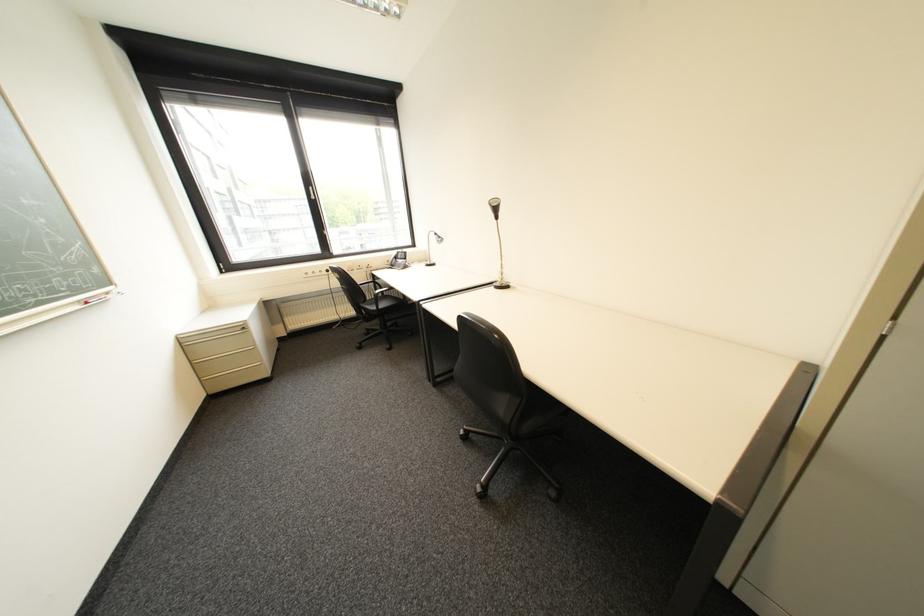
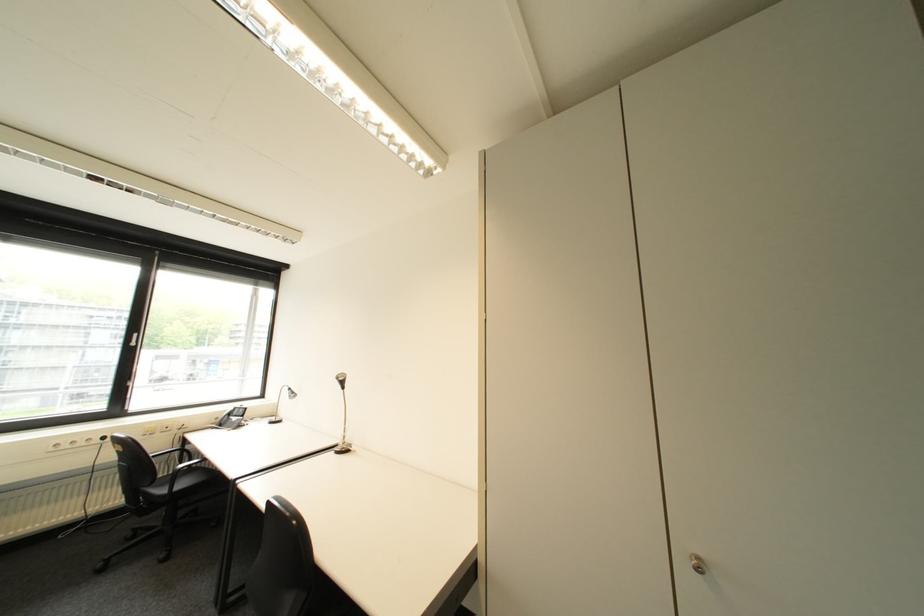
Locate, in the second image, the point that corresponds to [337,272] in the first image.

(114, 439)